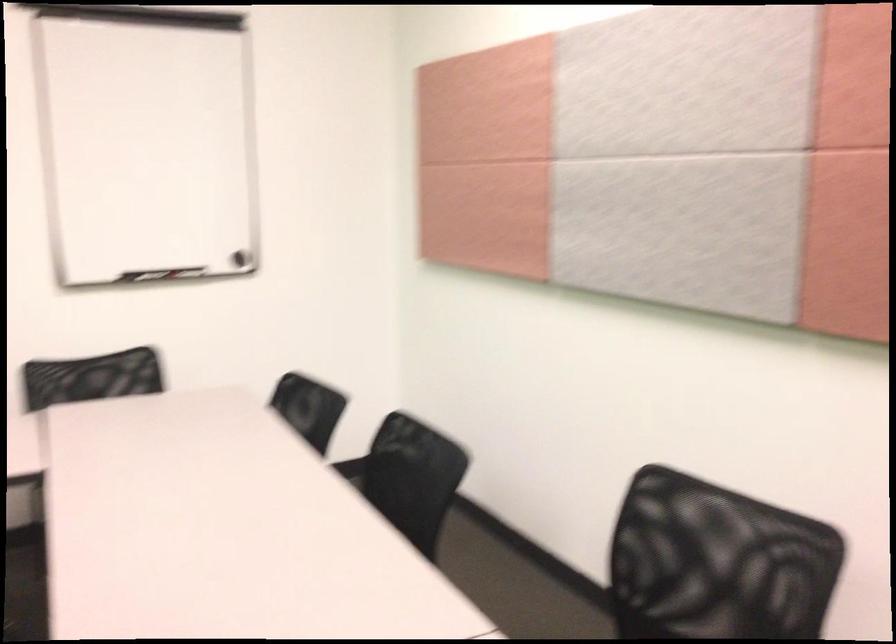
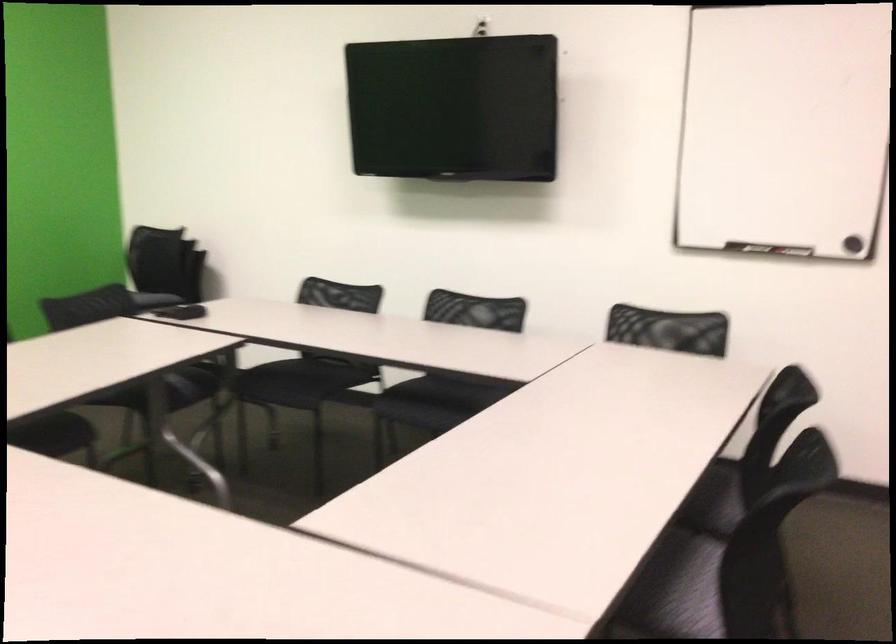
Question: I am providing you with two images of the same scene from different viewpoints. Which of the following objects are not visible in image2?

Choices:
 (A) black chair armrest
 (B) black chair sitting surface
 (C) small black object
 (D) red screwdriver handle

Answer: (A)